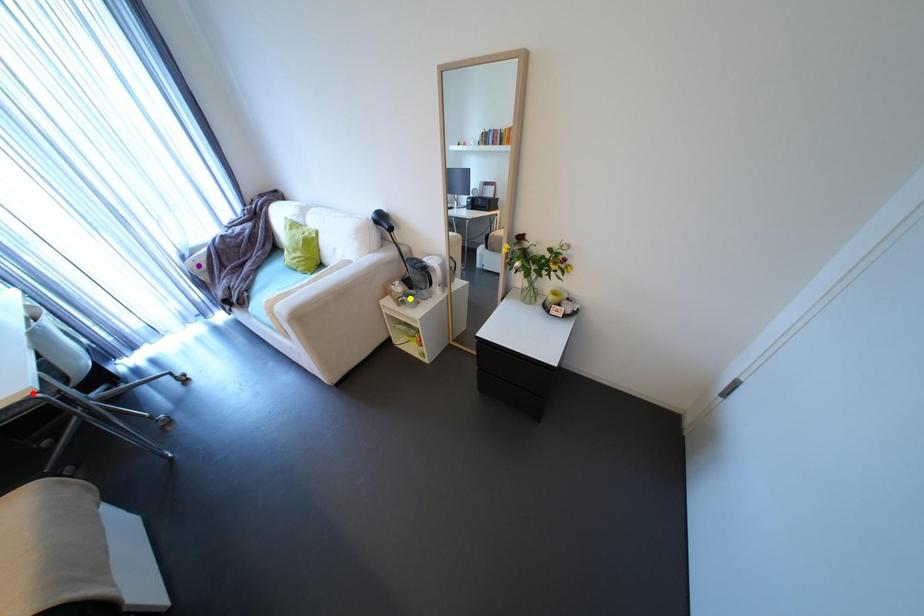
Order these from farthest to nearest:
red point | purple point | yellow point

1. purple point
2. yellow point
3. red point